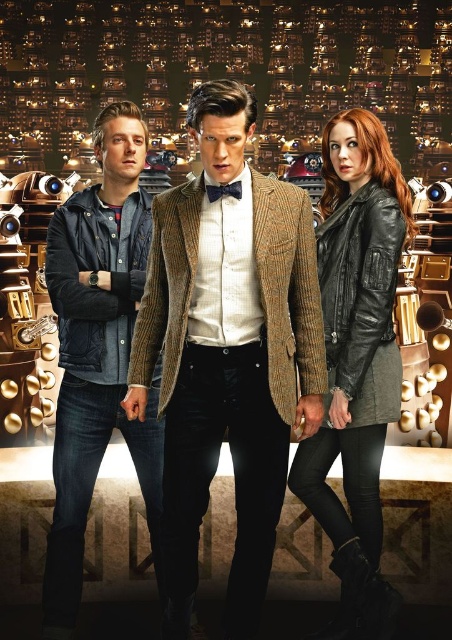
Between black leather jacket at right and denim jacket at left, which one is positioned lower?

black leather jacket at right is lower down.

Who is more forward, (358, 556) or (137, 204)?

Positioned in front is point (358, 556).

I want to click on black leather jacket at right, so click(357, 360).

Between brown woolen blazer at center and black leather jacket at right, which one is positioned lower?

Positioned lower is black leather jacket at right.

Where is `brown woolen blazer at center`? brown woolen blazer at center is located at coordinates (227, 349).

Does point (296, 209) come behind point (343, 291)?

No.

Find the location of a particular element. This screenshot has height=640, width=452. brown woolen blazer at center is located at coordinates (227, 349).

Which is behind, point (161, 538) or point (112, 179)?

Positioned behind is point (112, 179).

Which is in front, point (231, 312) or point (95, 428)?

Point (231, 312)

Which is in front, point (137, 330) or point (52, 518)?

Point (52, 518) is more forward.

Where is `brown woolen blazer at center`? The image size is (452, 640). brown woolen blazer at center is located at coordinates (227, 349).